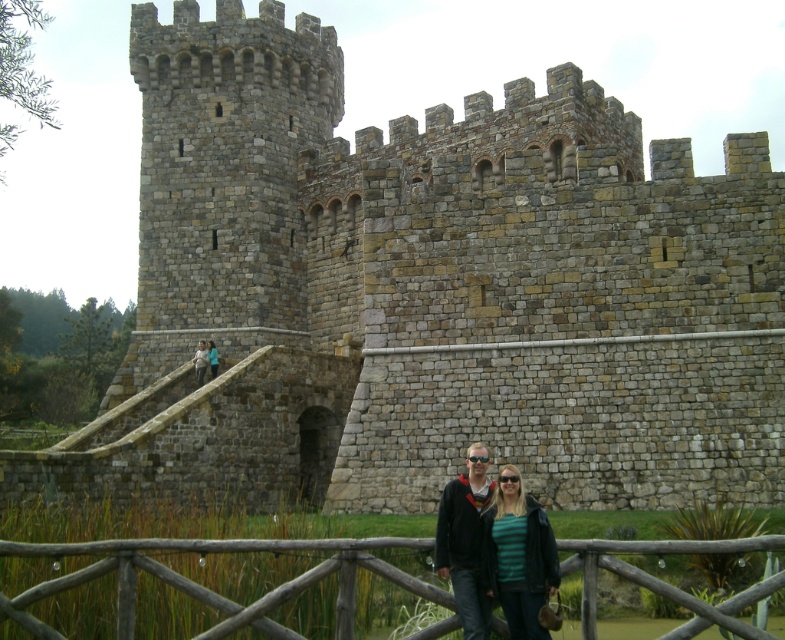
Question: From the image, what is the correct spatial relationship of matte black jacket at lower center in relation to light blue denim jacket at lower center?

Choices:
 (A) right
 (B) left

Answer: (A)

Question: Can you confirm if wooden fence at lower center is positioned above matte black jacket at lower center?

Choices:
 (A) yes
 (B) no

Answer: (B)

Question: Which point is closer to the camera taking this photo?

Choices:
 (A) click(239, 620)
 (B) click(203, 348)
 (C) click(448, 545)

Answer: (A)

Question: Which is farther from the matte black jacket at lower center?

Choices:
 (A) light blue denim jacket at lower center
 (B) wooden fence at lower center

Answer: (A)

Question: Which object appears farthest from the camera in this image?

Choices:
 (A) matte black jacket at lower center
 (B) light blue denim jacket at lower center
 (C) wooden fence at lower center

Answer: (B)

Question: Does wooden fence at lower center come behind matte black jacket at lower center?

Choices:
 (A) yes
 (B) no

Answer: (B)